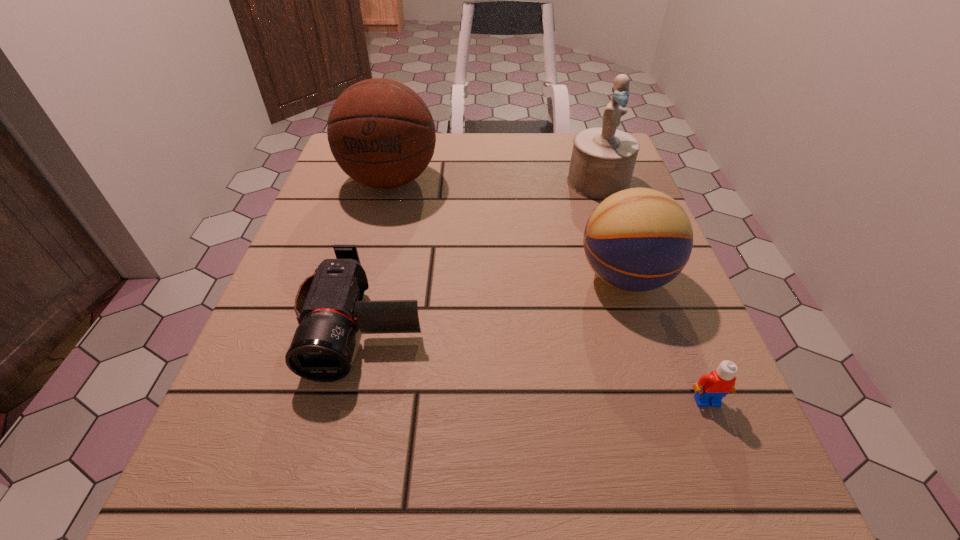
The image size is (960, 540). What are the coordinates of `figurine` in the screenshot? It's located at (603, 158).

The image size is (960, 540). I want to click on the taller basketball, so coord(381,133).

Where is `the left basketball`? the left basketball is located at coordinates (381, 133).

In order to click on the shorter basketball in this screenshot , I will do `click(639, 239)`.

This screenshot has height=540, width=960. I want to click on the right basketball, so click(x=639, y=239).

Where is `camcorder`? The image size is (960, 540). camcorder is located at coordinates (329, 308).

At what (x,y) coordinates should I click in order to perform the action: click on the nearest object. Please return your answer as a coordinate pair (x, y). This screenshot has width=960, height=540. Looking at the image, I should click on (711, 388).

At what (x,y) coordinates should I click in order to perform the action: click on vacant point located at the beak of the figurine. Please return your answer as a coordinate pair (x, y). This screenshot has height=540, width=960. Looking at the image, I should click on (617, 240).

Locate an element on the screen. The image size is (960, 540). vacant area situated on the side with brand label of the left basketball is located at coordinates (370, 259).

This screenshot has width=960, height=540. Find the location of `blank space located 0.150m on the patterned surface of the third shortest object`. blank space located 0.150m on the patterned surface of the third shortest object is located at coordinates (496, 277).